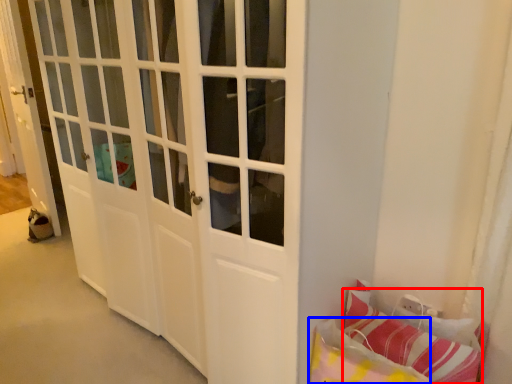
Question: Which point is further to the camera, pillow (highlighted by a red box) or pillow (highlighted by a blue box)?

Choices:
 (A) pillow
 (B) pillow

Answer: (A)